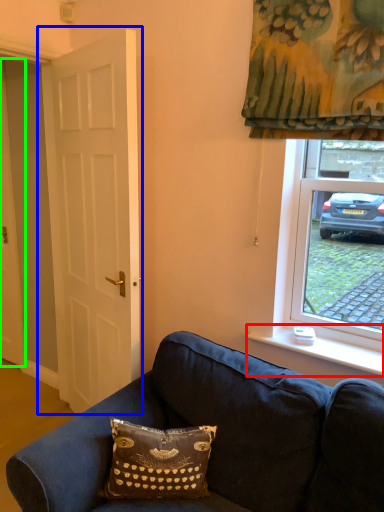
Question: Which is farther away from window sill (highlighted by a red box)? door (highlighted by a blue box) or door (highlighted by a green box)?

Choices:
 (A) door
 (B) door

Answer: (B)